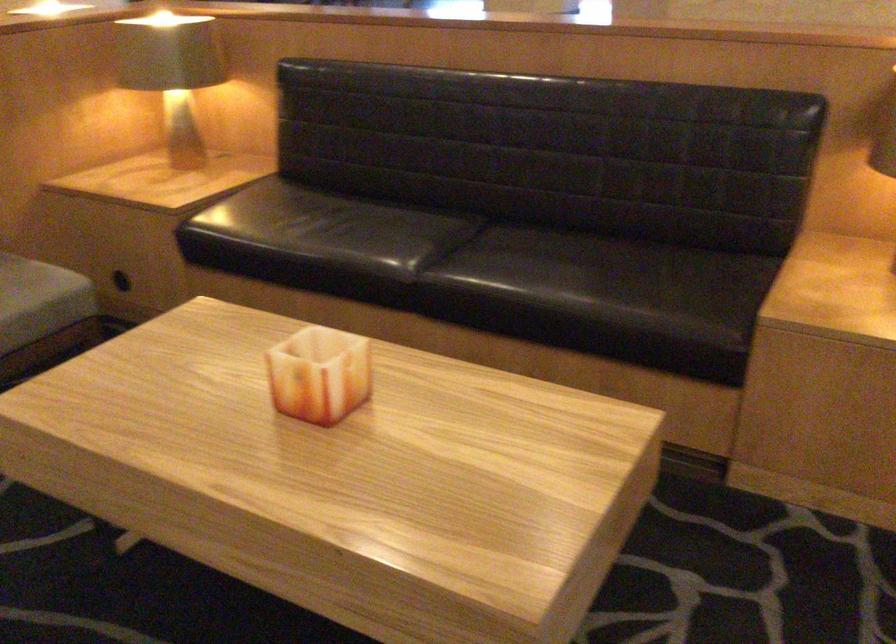
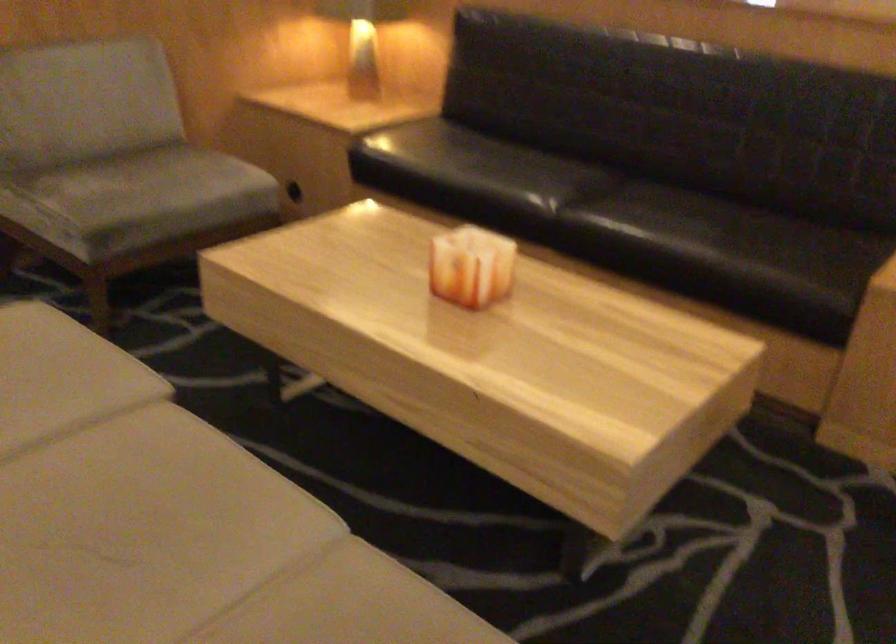
Question: The images are taken continuously from a first-person perspective. In which direction is your viewpoint rotating?

Choices:
 (A) Left
 (B) Right
 (C) Up
 (D) Down

Answer: (A)